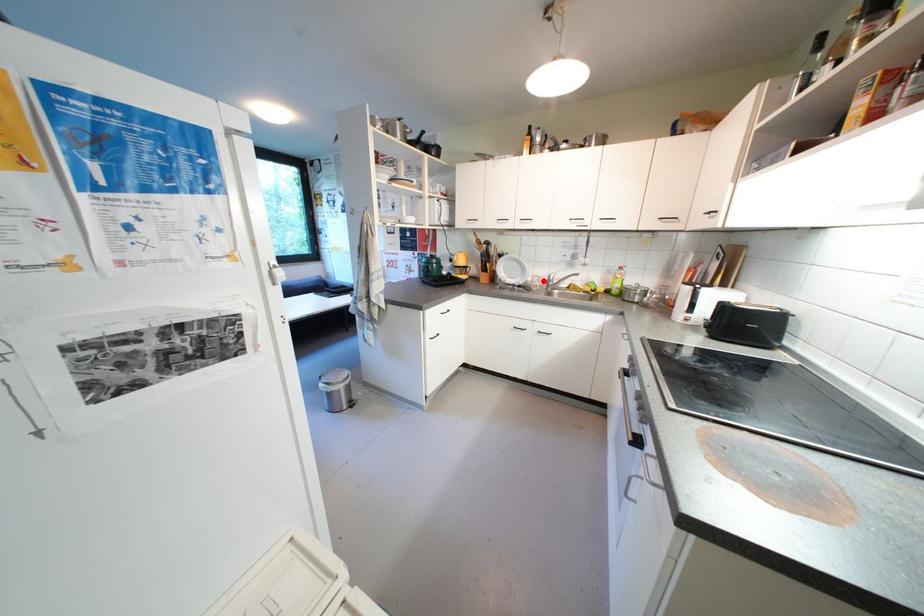
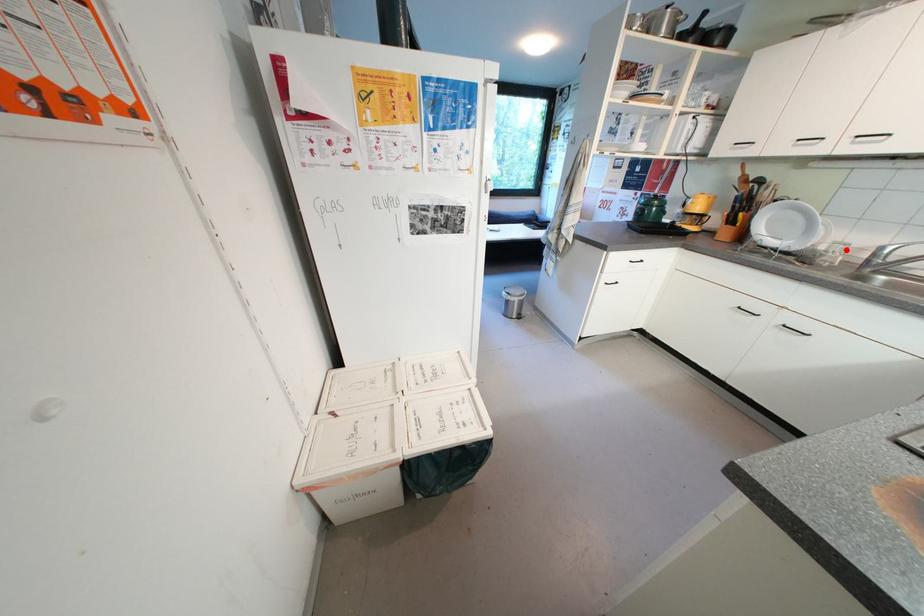
I am providing you with two images of the same scene from different viewpoints. A red point is marked on the first image and another point is marked on the second image. Does the point marked in image1 correspond to the same location as the one in image2?

Yes